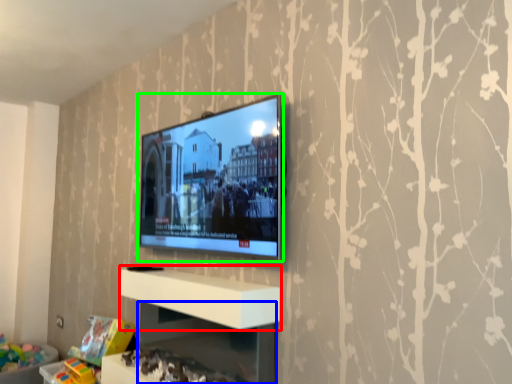
Question: Which object is positioned farthest from shelf (highlighted by a red box)? Select from shelf (highlighted by a blue box) and television (highlighted by a green box).

Choices:
 (A) shelf
 (B) television

Answer: (B)